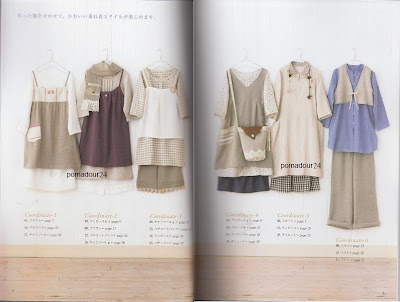
I want to click on columns, so click(26, 214), click(87, 215), click(150, 216), click(228, 215), click(278, 215), click(339, 238).